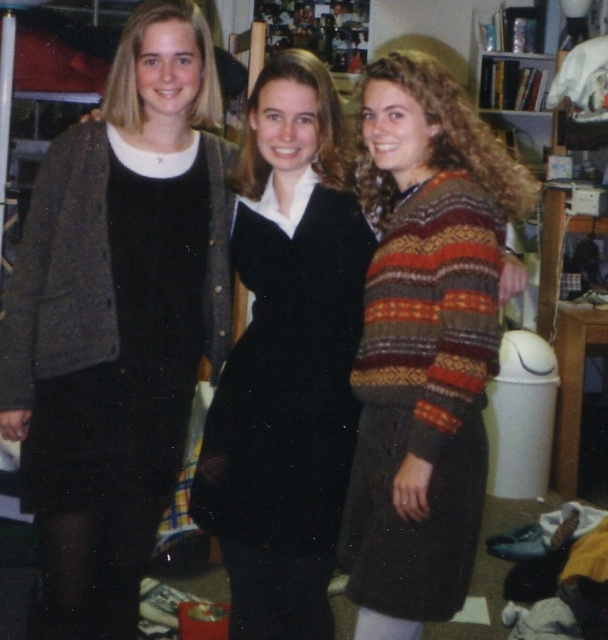
Question: Is matte black dress at left above knitted wool sweater at right?

Choices:
 (A) yes
 (B) no

Answer: (A)

Question: Based on their relative distances, which object is nearer to the matte black dress at left?

Choices:
 (A) knitted wool sweater at right
 (B) black velvet dress at center

Answer: (B)

Question: Is knitted wool sweater at right smaller than black velvet dress at center?

Choices:
 (A) yes
 (B) no

Answer: (B)

Question: Can you confirm if matte black dress at left is positioned to the right of black velvet dress at center?

Choices:
 (A) yes
 (B) no

Answer: (B)

Question: Which point is closer to the camera taking this photo?

Choices:
 (A) [331, 237]
 (B) [36, 282]

Answer: (B)

Question: Which object appears closest to the camera in this image?

Choices:
 (A) knitted wool sweater at right
 (B) black velvet dress at center

Answer: (A)